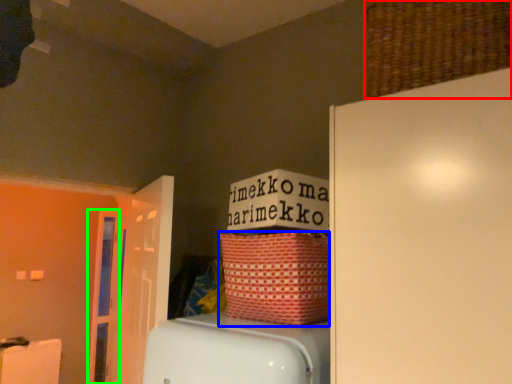
Question: Considering the real-world distances, which object is farthest from basket (highlighted by a red box)? basket (highlighted by a blue box) or door (highlighted by a green box)?

Choices:
 (A) basket
 (B) door

Answer: (B)